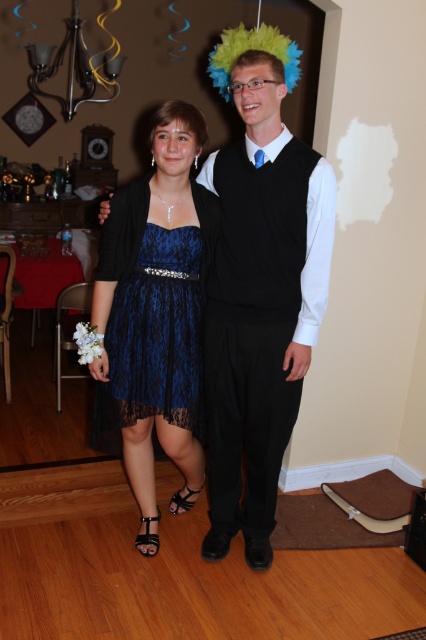
Is blue lace dress at center below navy lace dress at center?

Actually, blue lace dress at center is above navy lace dress at center.

Does blue lace dress at center have a lesser width compared to navy lace dress at center?

Yes, blue lace dress at center is thinner than navy lace dress at center.

Does point (281, 77) come behind point (169, 172)?

No, it is not.

Identify the location of blue lace dress at center. (259, 288).

Is point (198, 339) closer to viewer compared to point (180, 294)?

That is False.

Is navy lace dress at center behind lace blue dress at center?

No, navy lace dress at center is in front of lace blue dress at center.

Measure the distance between point (155, 506) and camera.

A distance of 2.40 meters exists between point (155, 506) and camera.

You are a GUI agent. You are given a task and a screenshot of the screen. Output one action in this format:
    pyautogui.click(x=<x>, y=<y>)
    Task: Click on the navy lace dress at center
    
    Given the screenshot: What is the action you would take?
    pyautogui.click(x=155, y=316)

Which is in front, point (227, 474) or point (198, 365)?

Point (198, 365) is in front.

Can you confirm if blue lace dress at center is positioned to the left of lace blue dress at center?

In fact, blue lace dress at center is to the right of lace blue dress at center.

Does point (288, 140) lie behind point (166, 392)?

No, it is not.

Locate an element on the screen. blue lace dress at center is located at coordinates (259, 288).